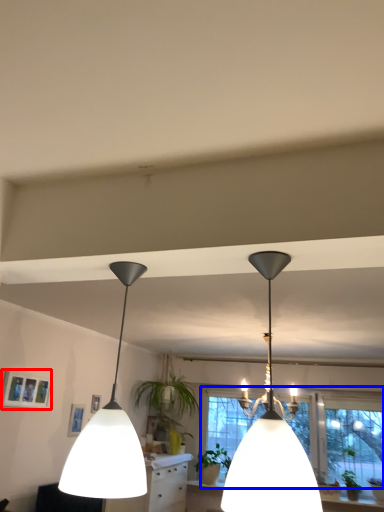
Question: Among these objects, which one is nearest to the camera, picture frame (highlighted by a red box) or window (highlighted by a blue box)?

Choices:
 (A) picture frame
 (B) window

Answer: (A)